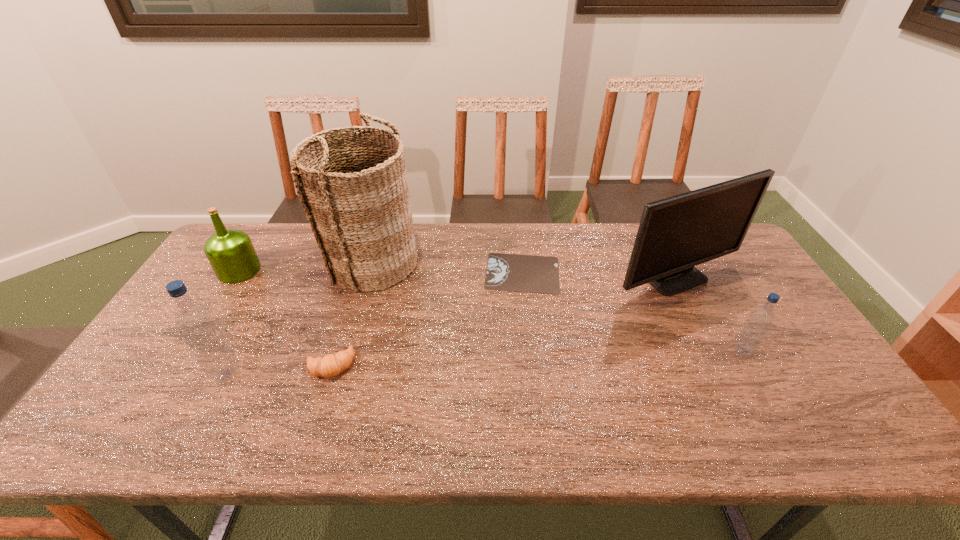
Locate an element on the screen. This screenshot has width=960, height=540. the closest object to the right water bottle is located at coordinates [675, 234].

You are a GUI agent. You are given a task and a screenshot of the screen. Output one action in this format:
    pyautogui.click(x=<x>, y=<y>)
    Task: Click on the vacant area in the image that satisfies the following two spatial constraints: 1. on the back side of the tallest object; 2. on the right side of the crescent roll
    
    Given the screenshot: What is the action you would take?
    pyautogui.click(x=364, y=261)

Locate an element on the screen. The width and height of the screenshot is (960, 540). free space that satisfies the following two spatial constraints: 1. on the back side of the sixth tallest object; 2. on the right side of the basket is located at coordinates (364, 261).

The width and height of the screenshot is (960, 540). In order to click on vacant space that satisfies the following two spatial constraints: 1. on the front side of the nearer water bottle; 2. on the left side of the leftmost object in this screenshot , I will do tap(173, 374).